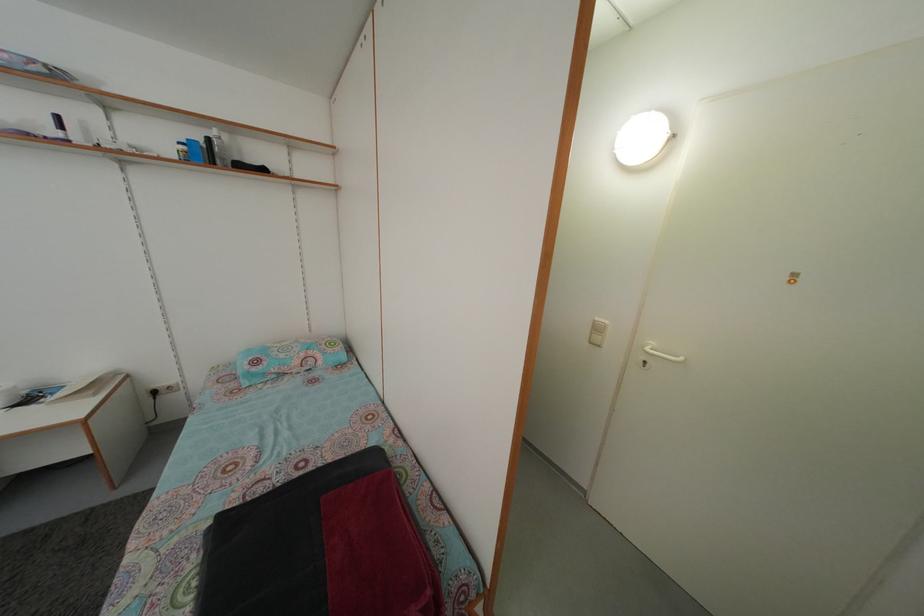
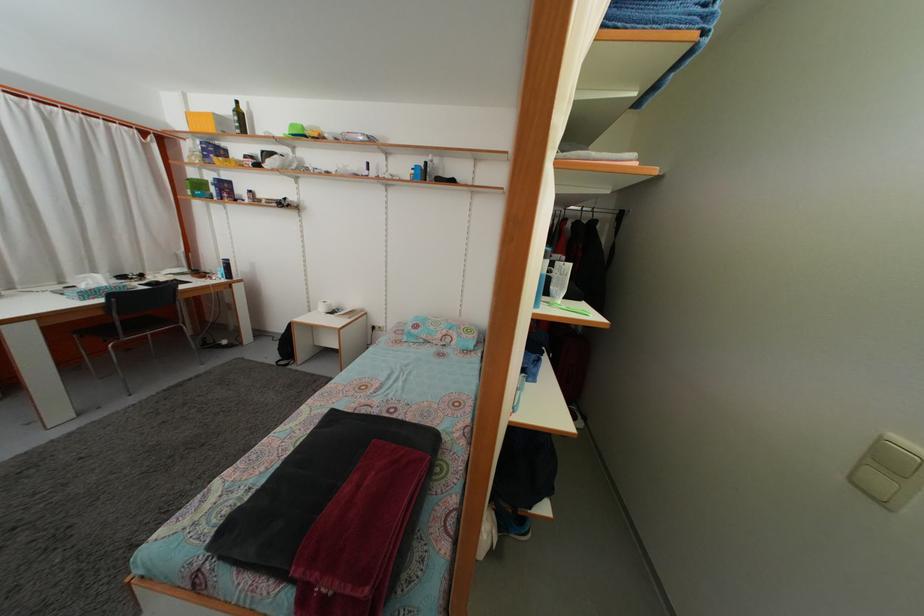
The point at (602, 326) is marked in the first image. Where is the corresponding point in the second image?

(903, 445)